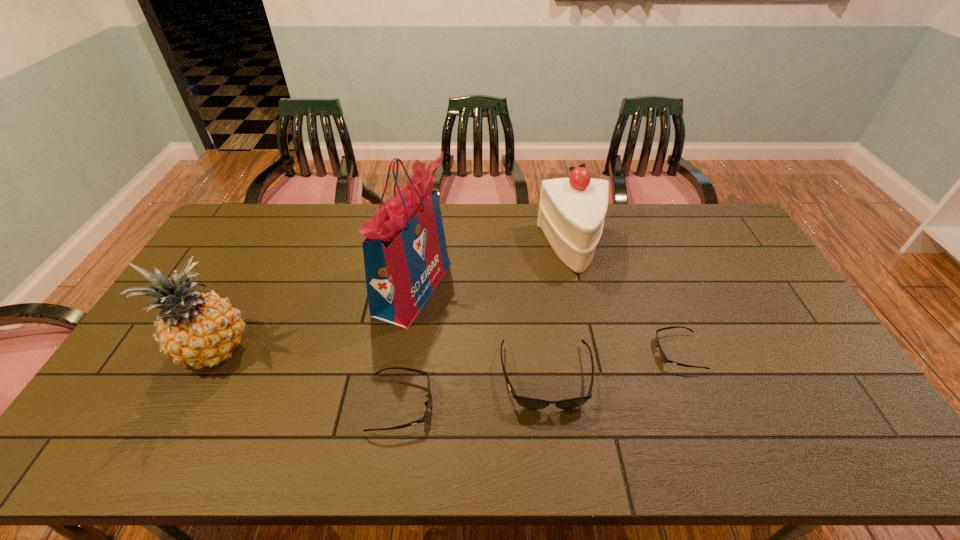
I want to click on the leftmost sunglasses, so pyautogui.click(x=422, y=420).

The width and height of the screenshot is (960, 540). I want to click on the fifth tallest object, so click(x=422, y=420).

Identify the location of the tallest sunglasses. tap(531, 403).

Locate an element on the screen. the fourth tallest object is located at coordinates (531, 403).

What are the coordinates of `the shortest sunglasses` in the screenshot? It's located at (663, 357).

The height and width of the screenshot is (540, 960). I want to click on the rightmost sunglasses, so click(663, 357).

Identify the location of grocery bag. The width and height of the screenshot is (960, 540). (405, 255).

What are the coordinates of `the third tallest object` in the screenshot? It's located at (571, 215).

This screenshot has width=960, height=540. In order to click on the leftmost object in this screenshot , I will do `click(194, 328)`.

Where is `pineapple`? This screenshot has width=960, height=540. pineapple is located at coordinates (194, 328).